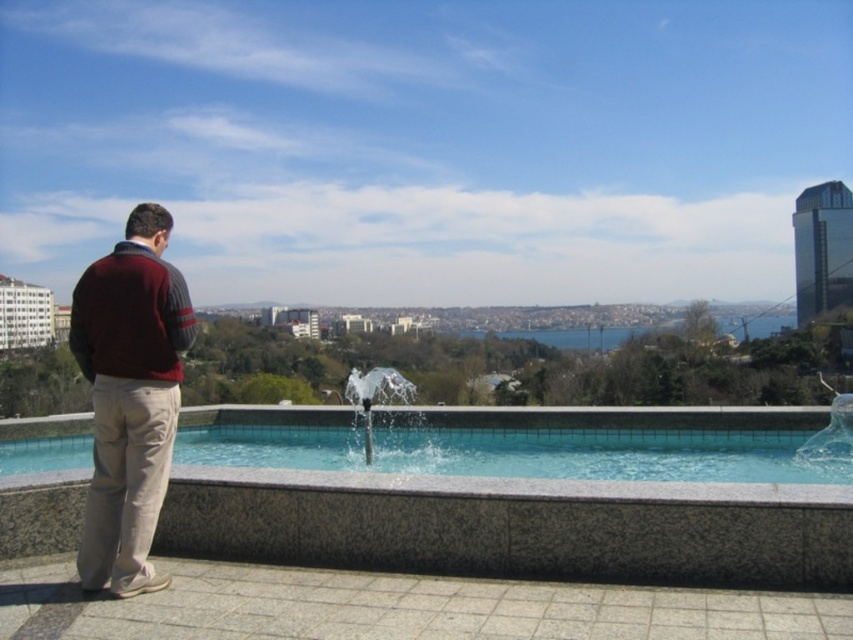
What is the exact coordinate of the maroon sweater at left?

The maroon sweater at left is located at coordinate point (x=129, y=397).

You are a photographer trying to capture the man in the maroon sweater at left and the clear glass water at center in the same frame. Based on their heights, which object would appear smaller in the photo?

The maroon sweater at left has a lesser height compared to the clear glass water at center, so the maroon sweater at left would appear smaller in the photo.